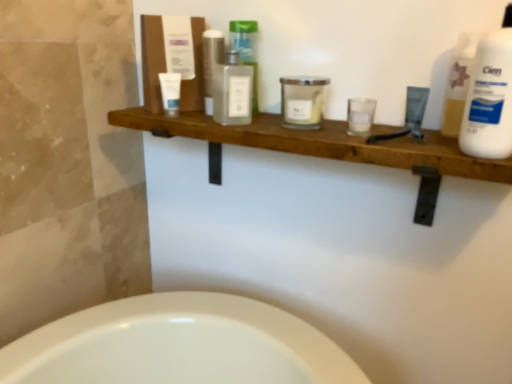
What do you see at coordinates (415, 110) in the screenshot? I see `matte black tube at upper right, the 6th toiletry from the left` at bounding box center [415, 110].

This screenshot has width=512, height=384. What are the coordinates of `translucent glass bottle at center, arranged as the fourth toiletry when viewed from the right` in the screenshot? It's located at (246, 50).

Measure the distance between clear glass candle at center, which ranks as the fifth toiletry in left-to-right order, and camera.

A distance of 31.99 inches exists between clear glass candle at center, which ranks as the fifth toiletry in left-to-right order, and camera.

Where is `clear glass candle at center, the second toiletry when ordered from right to left`? The height and width of the screenshot is (384, 512). clear glass candle at center, the second toiletry when ordered from right to left is located at coordinates (360, 116).

In order to click on matte black tube at upper right, the 6th toiletry from the left in this screenshot , I will do `click(415, 110)`.

Measure the distance between translucent glass bottle at center, arranged as the fourth toiletry when viewed from the right, and matte black tube at upper right, which is the first toiletry from right to left.

translucent glass bottle at center, arranged as the fourth toiletry when viewed from the right, and matte black tube at upper right, which is the first toiletry from right to left, are 15.04 inches apart.

In the scene shown: From a real-world perspective, is translucent glass bottle at center, arranged as the fourth toiletry when viewed from the right, over matte black tube at upper right, the 6th toiletry from the left?

Yes, from a real-world perspective, translucent glass bottle at center, arranged as the fourth toiletry when viewed from the right, is on top of matte black tube at upper right, the 6th toiletry from the left.

Is point (241, 50) closer to viewer compared to point (411, 100)?

No, it is behind (411, 100).

Considering the sizes of translucent glass bottle at center, the 3th toiletry in the left-to-right sequence, and matte black tube at upper right, the 6th toiletry from the left, in the image, is translucent glass bottle at center, the 3th toiletry in the left-to-right sequence, wider or thinner than matte black tube at upper right, the 6th toiletry from the left,?

In the image, translucent glass bottle at center, the 3th toiletry in the left-to-right sequence, appears to be wider than matte black tube at upper right, the 6th toiletry from the left.

Who is taller, clear glass bottle at center, the 5th toiletry in the right-to-left sequence, or white glass candle at center, the 4th toiletry from the left?

Standing taller between the two is clear glass bottle at center, the 5th toiletry in the right-to-left sequence.

How many degrees apart are the facing directions of clear glass bottle at center, acting as the 2th toiletry starting from the left, and white glass candle at center, the 4th toiletry from the left?

51.7 degrees separate the facing orientations of clear glass bottle at center, acting as the 2th toiletry starting from the left, and white glass candle at center, the 4th toiletry from the left.

From the image's perspective, is clear glass bottle at center, acting as the 2th toiletry starting from the left, under white glass candle at center, which is the third toiletry from right to left?

Incorrect, from the image's perspective, clear glass bottle at center, acting as the 2th toiletry starting from the left, is higher than white glass candle at center, which is the third toiletry from right to left.

This screenshot has width=512, height=384. I want to click on toiletry that is the 2nd one above the white glass candle at center, the 4th toiletry from the left (from a real-world perspective), so click(233, 91).

Is white matte tube at upper left, positioned as the 1th toiletry in left-to-right order, in front of or behind matte black tube at upper right, which is the first toiletry from right to left, in the image?

Visually, white matte tube at upper left, positioned as the 1th toiletry in left-to-right order, is located behind matte black tube at upper right, which is the first toiletry from right to left.

Considering the positions of points (172, 78) and (420, 92), is point (172, 78) closer to camera compared to point (420, 92)?

No, it is not.

Is white matte tube at upper left, arranged as the 6th toiletry when viewed from the right, next to matte black tube at upper right, which is the first toiletry from right to left, and touching it?

No, white matte tube at upper left, arranged as the 6th toiletry when viewed from the right, is not making contact with matte black tube at upper right, which is the first toiletry from right to left.

From the image's perspective, which toiletry is the 1st one below the white matte tube at upper left, arranged as the 6th toiletry when viewed from the right? Please provide its 2D coordinates.

[(233, 91)]

Which object is wider, white matte tube at upper left, arranged as the 6th toiletry when viewed from the right, or clear glass bottle at center, acting as the 2th toiletry starting from the left?

clear glass bottle at center, acting as the 2th toiletry starting from the left.

Would you say white matte tube at upper left, positioned as the 1th toiletry in left-to-right order, is inside or outside clear glass bottle at center, acting as the 2th toiletry starting from the left?

A: white matte tube at upper left, positioned as the 1th toiletry in left-to-right order, is outside clear glass bottle at center, acting as the 2th toiletry starting from the left.

Consider the image. Is white matte tube at upper left, positioned as the 1th toiletry in left-to-right order, aimed at clear glass bottle at center, acting as the 2th toiletry starting from the left?

No, white matte tube at upper left, positioned as the 1th toiletry in left-to-right order, does not turn towards clear glass bottle at center, acting as the 2th toiletry starting from the left.

Is point (406, 100) less distant than point (481, 89)?

No, it is behind (481, 89).

Considering the relative positions of matte black tube at upper right, which is the first toiletry from right to left, and white plastic bottle at upper right in the image provided, is matte black tube at upper right, which is the first toiletry from right to left, behind white plastic bottle at upper right?

Yes, the depth of matte black tube at upper right, which is the first toiletry from right to left, is greater than that of white plastic bottle at upper right.

From the image's perspective, which is below, matte black tube at upper right, which is the first toiletry from right to left, or white plastic bottle at upper right?

matte black tube at upper right, which is the first toiletry from right to left, from the image's perspective.

Can we say matte black tube at upper right, the 6th toiletry from the left, lies outside white plastic bottle at upper right?

matte black tube at upper right, the 6th toiletry from the left, is positioned outside white plastic bottle at upper right.

Which of these two, matte black tube at upper right, which is the first toiletry from right to left, or clear glass bottle at center, the 5th toiletry in the right-to-left sequence, is smaller?

matte black tube at upper right, which is the first toiletry from right to left.

Is matte black tube at upper right, the 6th toiletry from the left, touching clear glass bottle at center, the 5th toiletry in the right-to-left sequence?

No, matte black tube at upper right, the 6th toiletry from the left, is not with clear glass bottle at center, the 5th toiletry in the right-to-left sequence.

Does point (405, 116) come closer to viewer compared to point (220, 66)?

Yes, point (405, 116) is closer to viewer.

From the picture: Considering the sizes of matte black tube at upper right, which is the first toiletry from right to left, and clear glass bottle at center, the 5th toiletry in the right-to-left sequence, in the image, is matte black tube at upper right, which is the first toiletry from right to left, taller or shorter than clear glass bottle at center, the 5th toiletry in the right-to-left sequence,?

Clearly, matte black tube at upper right, which is the first toiletry from right to left, is shorter compared to clear glass bottle at center, the 5th toiletry in the right-to-left sequence.

Is white glass candle at center, the 4th toiletry from the left, at the back of white plastic bottle at upper right?

No, white plastic bottle at upper right is not facing away from white glass candle at center, the 4th toiletry from the left.

Identify the location of cleaning product in front of the white glass candle at center, which is the third toiletry from right to left. (490, 97).

From the image's perspective, relative to white glass candle at center, the 4th toiletry from the left, is white plastic bottle at upper right above or below?

white plastic bottle at upper right is situated lower than white glass candle at center, the 4th toiletry from the left, in the image.

There is a translucent glass bottle at center, the 3th toiletry in the left-to-right sequence. Identify the location of the 4th toiletry below it (from a real-world perspective). (415, 110).

I want to click on the 2nd toiletry counting from the left of the white glass candle at center, which is the third toiletry from right to left, so click(233, 91).

Estimate the real-world distances between objects in this image. Which object is further from clear glass candle at center, the second toiletry when ordered from right to left, clear glass bottle at center, acting as the 2th toiletry starting from the left, or translucent glass bottle at center, arranged as the fourth toiletry when viewed from the right?

The object further to clear glass candle at center, the second toiletry when ordered from right to left, is translucent glass bottle at center, arranged as the fourth toiletry when viewed from the right.

Consider the image. From the image, which object appears to be farther from matte black tube at upper right, which is the first toiletry from right to left, white glass candle at center, which is the third toiletry from right to left, or clear glass bottle at center, the 5th toiletry in the right-to-left sequence?

clear glass bottle at center, the 5th toiletry in the right-to-left sequence, lies further to matte black tube at upper right, which is the first toiletry from right to left, than the other object.

Based on their spatial positions, is matte black tube at upper right, the 6th toiletry from the left, or clear glass candle at center, which ranks as the fifth toiletry in left-to-right order, further from translucent glass bottle at center, arranged as the fourth toiletry when viewed from the right?

Based on the image, matte black tube at upper right, the 6th toiletry from the left, appears to be further to translucent glass bottle at center, arranged as the fourth toiletry when viewed from the right.

From the image, which object appears to be farther from white glass candle at center, the 4th toiletry from the left, translucent glass bottle at center, the 3th toiletry in the left-to-right sequence, or clear glass candle at center, which ranks as the fifth toiletry in left-to-right order?

Among the two, translucent glass bottle at center, the 3th toiletry in the left-to-right sequence, is located further to white glass candle at center, the 4th toiletry from the left.

When comparing their distances from matte black tube at upper right, which is the first toiletry from right to left, does white plastic bottle at upper right or translucent glass bottle at center, the 3th toiletry in the left-to-right sequence, seem further?

Among the two, translucent glass bottle at center, the 3th toiletry in the left-to-right sequence, is located further to matte black tube at upper right, which is the first toiletry from right to left.

When comparing their distances from clear glass candle at center, the second toiletry when ordered from right to left, does white plastic bottle at upper right or clear glass bottle at center, acting as the 2th toiletry starting from the left, seem further?

clear glass bottle at center, acting as the 2th toiletry starting from the left, is positioned further to the anchor clear glass candle at center, the second toiletry when ordered from right to left.

Based on their spatial positions, is white plastic bottle at upper right or white matte tube at upper left, arranged as the 6th toiletry when viewed from the right, further from translucent glass bottle at center, arranged as the fourth toiletry when viewed from the right?

white plastic bottle at upper right lies further to translucent glass bottle at center, arranged as the fourth toiletry when viewed from the right, than the other object.

When comparing their distances from clear glass bottle at center, the 5th toiletry in the right-to-left sequence, does white plastic bottle at upper right or clear glass candle at center, the second toiletry when ordered from right to left, seem further?

white plastic bottle at upper right is positioned further to the anchor clear glass bottle at center, the 5th toiletry in the right-to-left sequence.

Identify the location of toiletry located between translucent glass bottle at center, the 3th toiletry in the left-to-right sequence, and clear glass candle at center, which ranks as the fifth toiletry in left-to-right order, in the left-right direction. Image resolution: width=512 pixels, height=384 pixels. (302, 101).

Identify the location of toiletry between clear glass bottle at center, acting as the 2th toiletry starting from the left, and white glass candle at center, which is the third toiletry from right to left, in the horizontal direction. (246, 50).

At what (x,y) coordinates should I click in order to perform the action: click on toiletry between white matte tube at upper left, positioned as the 1th toiletry in left-to-right order, and translucent glass bottle at center, arranged as the fourth toiletry when viewed from the right. Please return your answer as a coordinate pair (x, y). This screenshot has height=384, width=512. Looking at the image, I should click on (233, 91).

At what (x,y) coordinates should I click in order to perform the action: click on toiletry between white glass candle at center, which is the third toiletry from right to left, and matte black tube at upper right, the 6th toiletry from the left, from left to right. Please return your answer as a coordinate pair (x, y). Image resolution: width=512 pixels, height=384 pixels. Looking at the image, I should click on (360, 116).